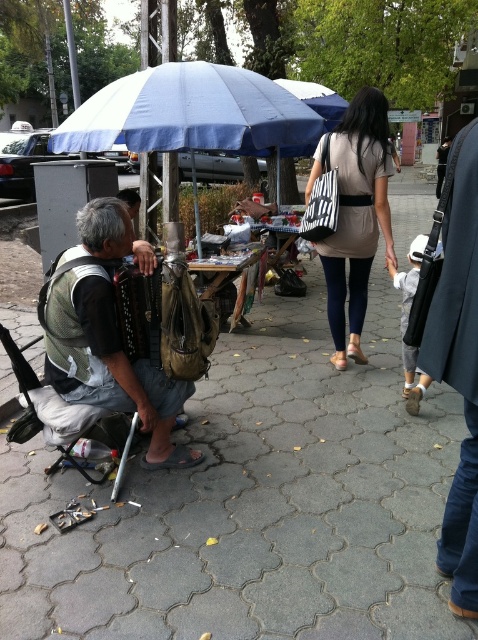
Please describe the object located at point (254, 502) in the image.

The object located at point (254, 502) is the gray cobblestone pavement at center.

You are a photographer standing in the street scene. You want to take a photo of the beige fabric bag at center without the blue fabric umbrella at upper center blocking it. Is this possible?

The blue fabric umbrella at upper center is above the beige fabric bag at center, so it will block the view. Move the camera angle downward to avoid the umbrella.

What is the color of the object located at the coordinates point [254,502] in the image?

The object at point [254,502] is gray cobblestone pavement.